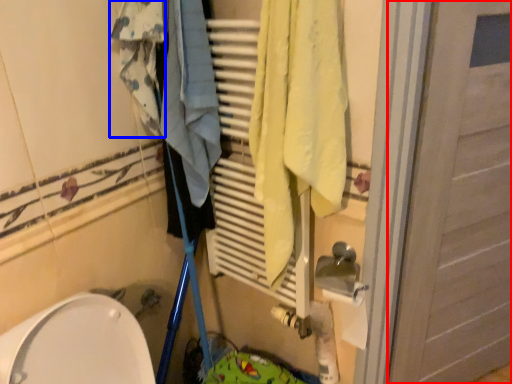
Question: Which object is closer to the camera taking this photo, door (highlighted by a red box) or clothing (highlighted by a blue box)?

Choices:
 (A) door
 (B) clothing

Answer: (A)